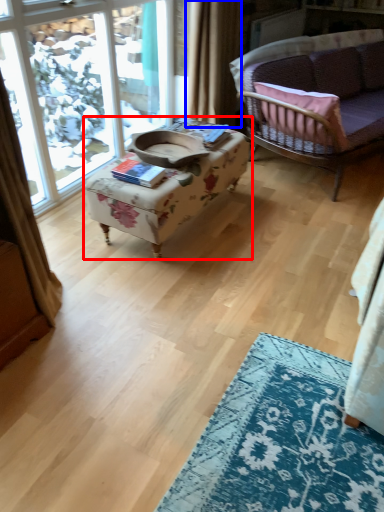
Question: Which object is further to the camera taking this photo, table (highlighted by a red box) or curtain (highlighted by a blue box)?

Choices:
 (A) table
 (B) curtain

Answer: (B)